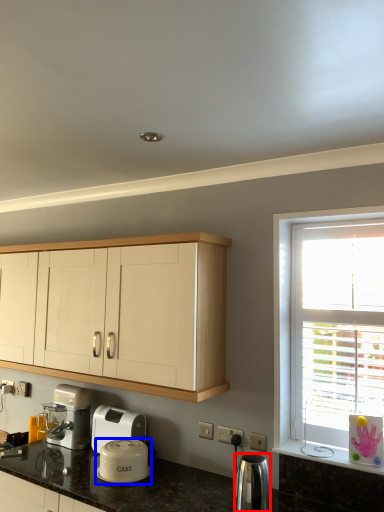
Question: Which object is closer to the camera taking this photo, kitchen appliance (highlighted by a red box) or kitchen appliance (highlighted by a blue box)?

Choices:
 (A) kitchen appliance
 (B) kitchen appliance

Answer: (A)